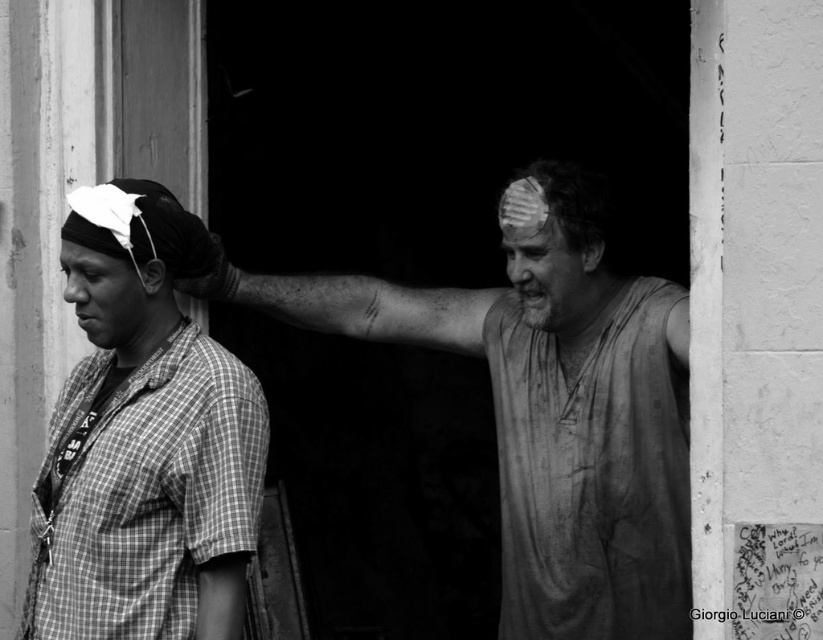
Question: Is white fabric headband at left to the left of dirty white head at right from the viewer's perspective?

Choices:
 (A) no
 (B) yes

Answer: (B)

Question: Which of the following is the farthest from the observer?

Choices:
 (A) (91, 602)
 (B) (117, 298)
 (C) (582, 328)
 (D) (586, 401)

Answer: (C)

Question: Which of the following is the farthest from the observer?

Choices:
 (A) dirty white tank top at center
 (B) checkered fabric shirt at left
 (C) matte white bandage at upper center
 (D) smooth skin face at center

Answer: (C)

Question: Considering the relative positions of checkered fabric shirt at left and dirty white head at right in the image provided, where is checkered fabric shirt at left located with respect to dirty white head at right?

Choices:
 (A) above
 (B) below

Answer: (B)

Question: Which point is closer to the camera?

Choices:
 (A) (570, 244)
 (B) (551, 225)
 (C) (200, 352)
 (D) (240, 376)

Answer: (D)

Question: Does checkered fabric shirt at left have a smaller size compared to dirty white head at right?

Choices:
 (A) no
 (B) yes

Answer: (A)